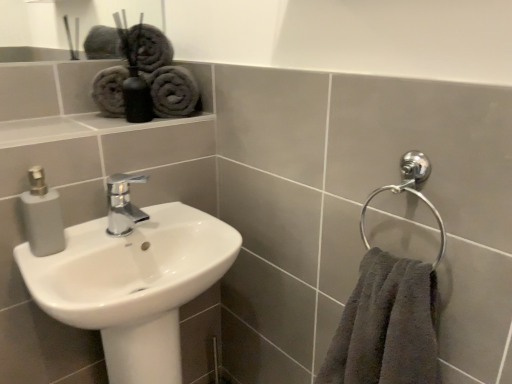
Find the location of a particular element. free spot behind polished chrome faucet at center is located at coordinates (153, 212).